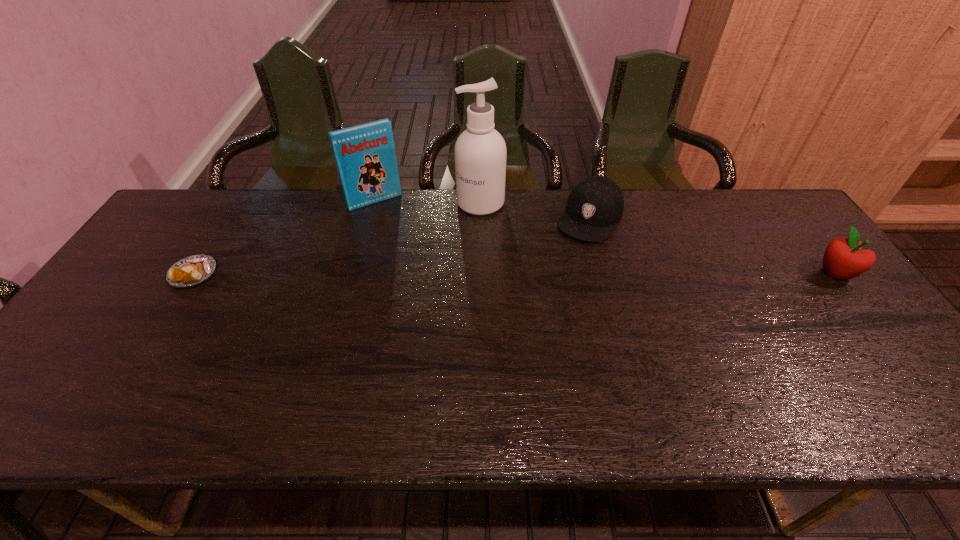
Identify the location of free space between the apple and the shortest object. The height and width of the screenshot is (540, 960). (515, 274).

The image size is (960, 540). In order to click on vacant point located between the rightmost object and the cleansing agent in this screenshot , I will do `click(658, 238)`.

Where is `free space between the fourth object from left to right and the leftmost object`? The height and width of the screenshot is (540, 960). free space between the fourth object from left to right and the leftmost object is located at coordinates (393, 246).

Find the location of a particular element. The width and height of the screenshot is (960, 540). vacant point located between the pastry and the apple is located at coordinates [x=515, y=274].

Identify the location of free space that is in between the second object from right to left and the cleansing agent. This screenshot has width=960, height=540. (536, 210).

In order to click on vacant area that lies between the fourth object from left to right and the shortest object in this screenshot , I will do (393, 246).

Identify which object is the closest to the second object from right to left. Please provide its 2D coordinates. Your answer should be formatted as a tuple, i.e. [(x, y)], where the tuple contains the x and y coordinates of a point satisfying the conditions above.

[(480, 152)]

What are the coordinates of `object that is the third closest one to the apple` in the screenshot? It's located at (365, 156).

Identify the location of vacant point that satisfies the following two spatial constraints: 1. on the back side of the shortest object; 2. on the side where a bite is taken out of the rightmost object. This screenshot has width=960, height=540. (195, 273).

In order to click on blank area in the image that satisfies the following two spatial constraints: 1. on the back side of the shortest object; 2. on the left side of the cap in this screenshot , I will do `click(229, 218)`.